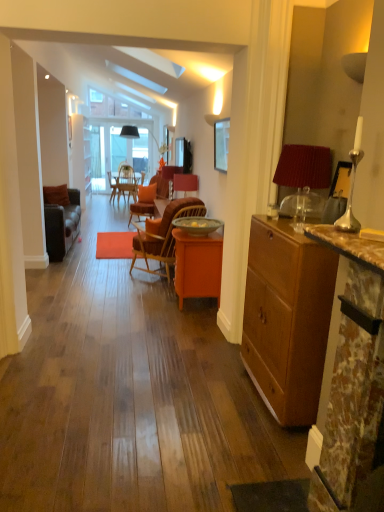
Question: Considering the positions of velvet orange chair at center, the second chair in the front-to-back sequence, and orange wood desk at center in the image, is velvet orange chair at center, the second chair in the front-to-back sequence, bigger or smaller than orange wood desk at center?

Choices:
 (A) small
 (B) big

Answer: (A)

Question: Is velvet orange chair at center, marked as the 1th chair in a top-to-bottom arrangement, situated inside orange wood desk at center or outside?

Choices:
 (A) inside
 (B) outside

Answer: (B)

Question: Which of these objects is positioned closest to the velvet orange chair at center, which is counted as the first chair, starting from the back?

Choices:
 (A) wooden cabinet at right
 (B) woven wood chair at center, the first chair positioned from the front
 (C) orange wood desk at center
 (D) brown marble fireplace at right
 (E) red fabric lampshade at right

Answer: (B)

Question: Which object is positioned closest to the red fabric lampshade at right?

Choices:
 (A) wooden cabinet at right
 (B) velvet orange chair at center, the second chair in the front-to-back sequence
 (C) matte glass picture frame at upper center
 (D) brown marble fireplace at right
 (E) woven wood chair at center, arranged as the second chair when viewed from the back

Answer: (A)